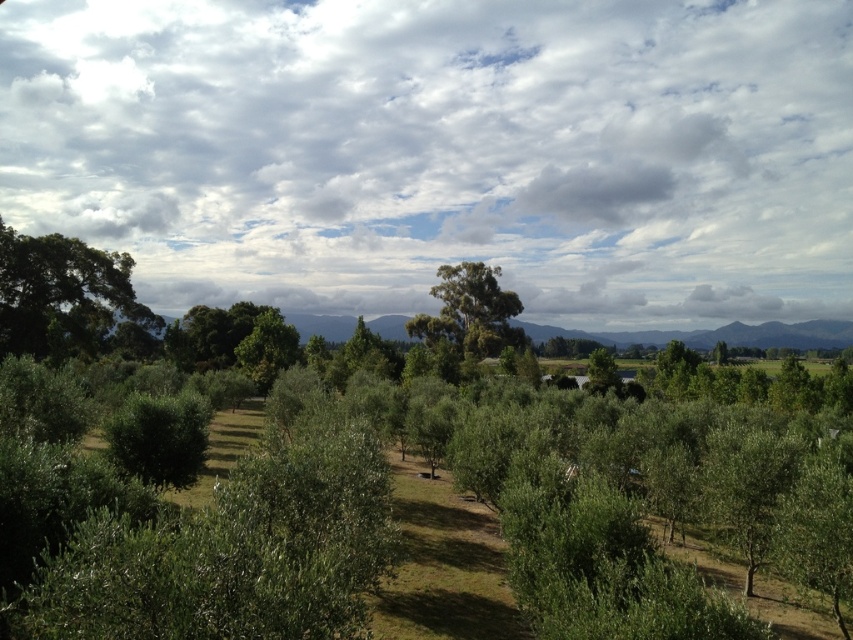
You are standing in the middle of the olive grove and want to look up at the cloudy sky at upper center. Which direction should you turn your head to see it relative to the green leafy tree at center?

The cloudy sky at upper center is to the left of the green leafy tree at center, so you should turn your head to the left to see it relative to the tree.